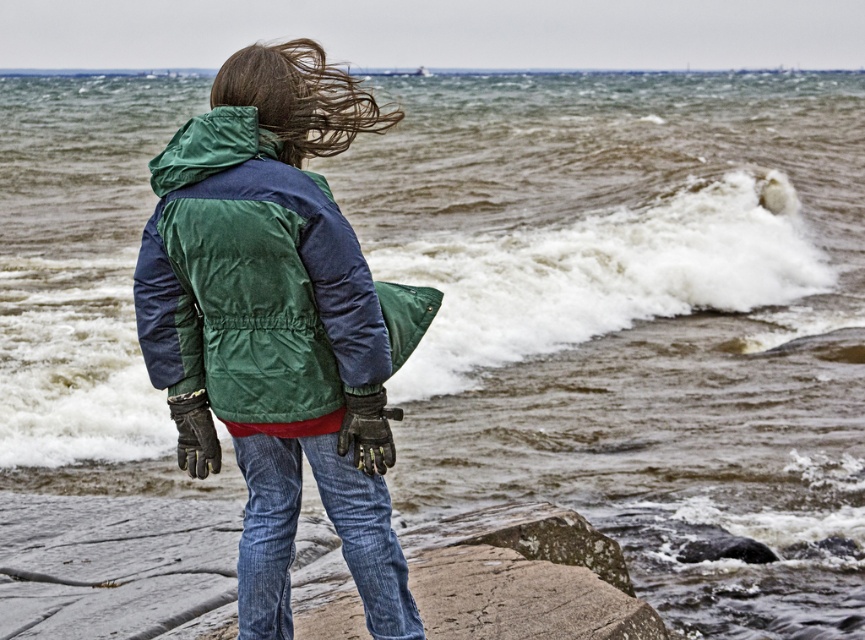
Is green quilted jacket at center to the right of denim jeans at lower center from the viewer's perspective?

Incorrect, green quilted jacket at center is not on the right side of denim jeans at lower center.

Which is below, green quilted jacket at center or denim jeans at lower center?

Positioned lower is denim jeans at lower center.

This screenshot has height=640, width=865. What are the coordinates of `green quilted jacket at center` in the screenshot? It's located at (261, 285).

Between denim jeans at lower center and blonde silky hair at upper center, which one has more height?

Standing taller between the two is blonde silky hair at upper center.

Does denim jeans at lower center appear under blonde silky hair at upper center?

Indeed, denim jeans at lower center is positioned under blonde silky hair at upper center.

Is point (357, 477) positioned after point (330, 145)?

That is False.

Where is `denim jeans at lower center`? denim jeans at lower center is located at coordinates (335, 531).

Who is more distant from viewer, (x=267, y=186) or (x=258, y=93)?

The point (x=258, y=93) is behind.

Who is more forward, [176,326] or [266,108]?

Point [266,108] is in front.

Where is `green quilted jacket at center`? This screenshot has height=640, width=865. green quilted jacket at center is located at coordinates (261, 285).